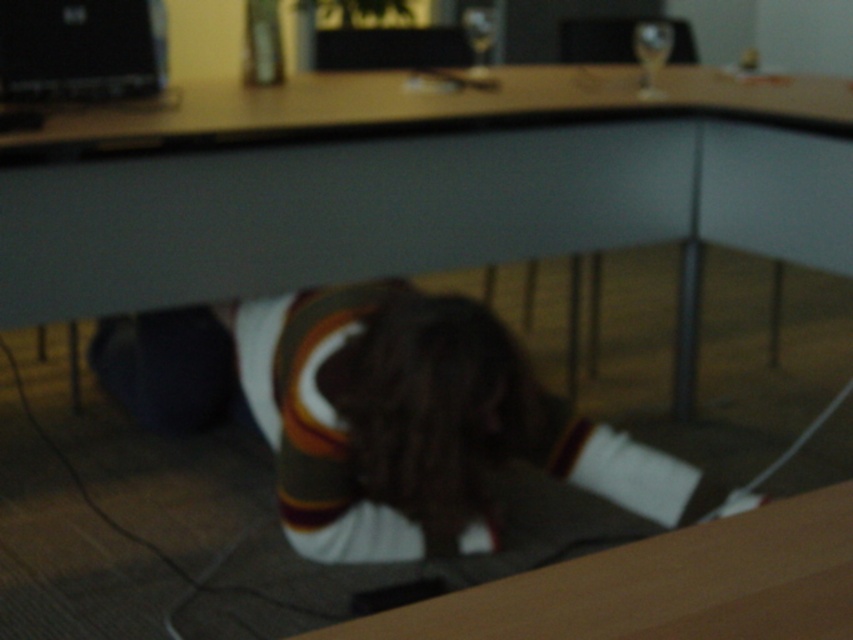
In the scene shown: You are trying to locate the brown jersey at center in a room with a smooth wood computer desk at center. According to the scene, which object is positioned to the right of the other?

The smooth wood computer desk at center is to the right of the brown jersey at center.

You are trying to set up a standing desk and need to know the height difference between the smooth wood computer desk at center and the black matte laptop at upper left. Which one is taller?

The smooth wood computer desk at center is taller than the black matte laptop at upper left according to the description.

You are standing at the entrance of the room and want to place a 5.5 feet long package between the brown jersey at center and the counter in the background. Is there enough space?

The distance between the brown jersey at center and the counter in the background is 5.29 feet. Since the package is 5.5 feet long, it is slightly longer than the available space. Therefore, the package cannot be placed there without overlapping.